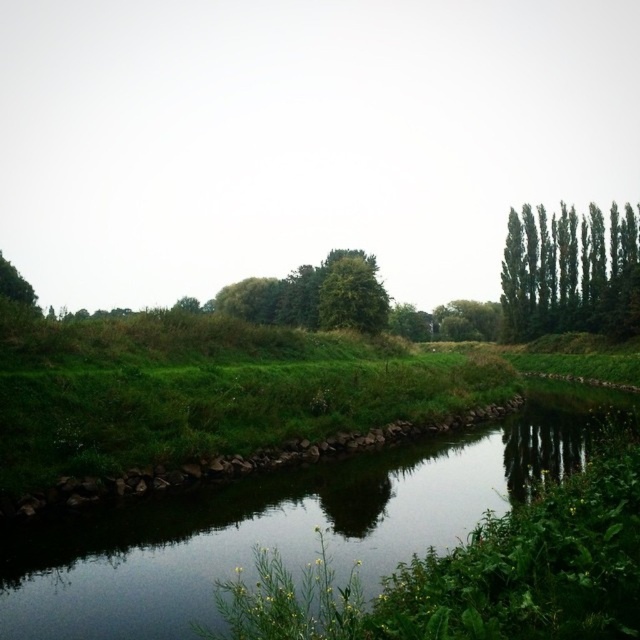
You are standing at the edge of the waterway in the scene and notice two points marked on the ground. One is at coordinate point (337,550) and the other at point (13,282). Which point is closer to your current position?

Point (337,550) is closer to the camera than point (13,282), so the point at (337,550) is closer to your current position.

You are standing at the origin point in the image. Where is the green grassy river at center located in terms of its 2D coordinates?

The green grassy river at center is located at the 2D coordinates of point [284,524].